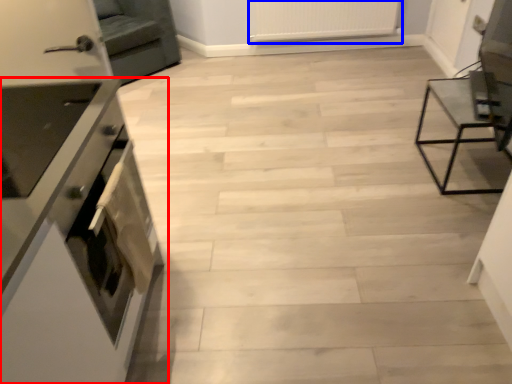
Question: Which point is further to the camera, cabinetry (highlighted by a red box) or radiator (highlighted by a blue box)?

Choices:
 (A) cabinetry
 (B) radiator

Answer: (B)